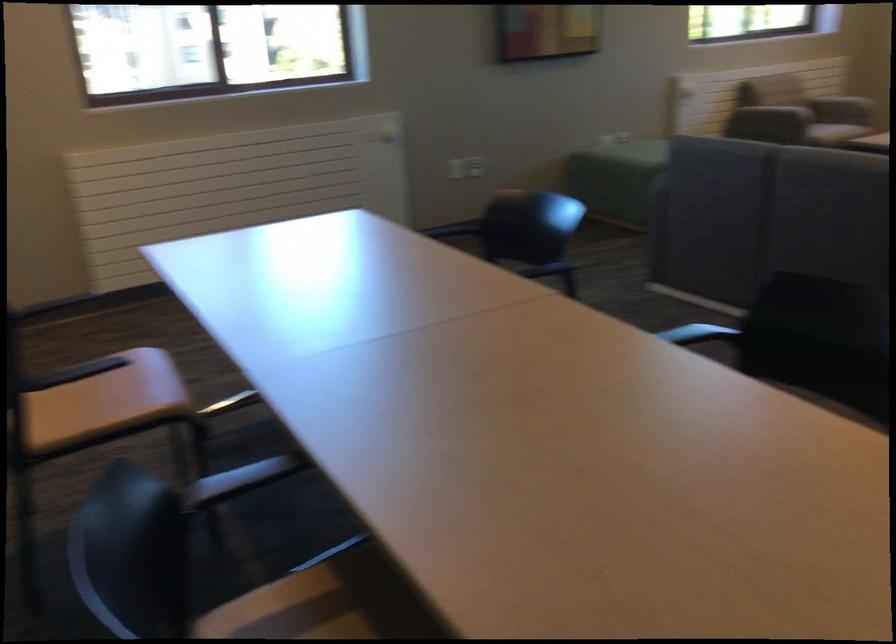
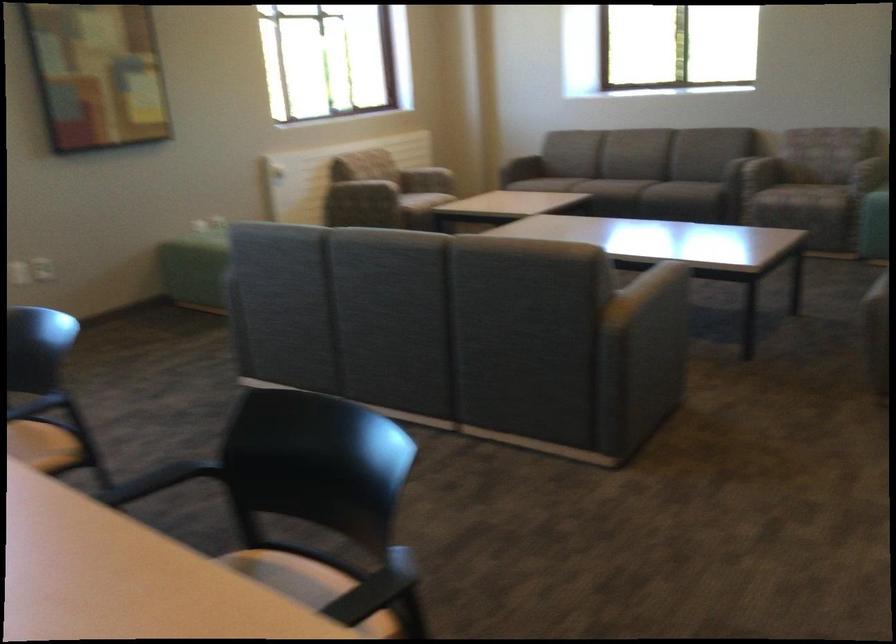
Question: The camera is either moving clockwise (left) or counter-clockwise (right) around the object. The first image is from the beginning of the video and the second image is from the end. Is the camera moving left or right when shooting the video?

Choices:
 (A) Left
 (B) Right

Answer: (A)